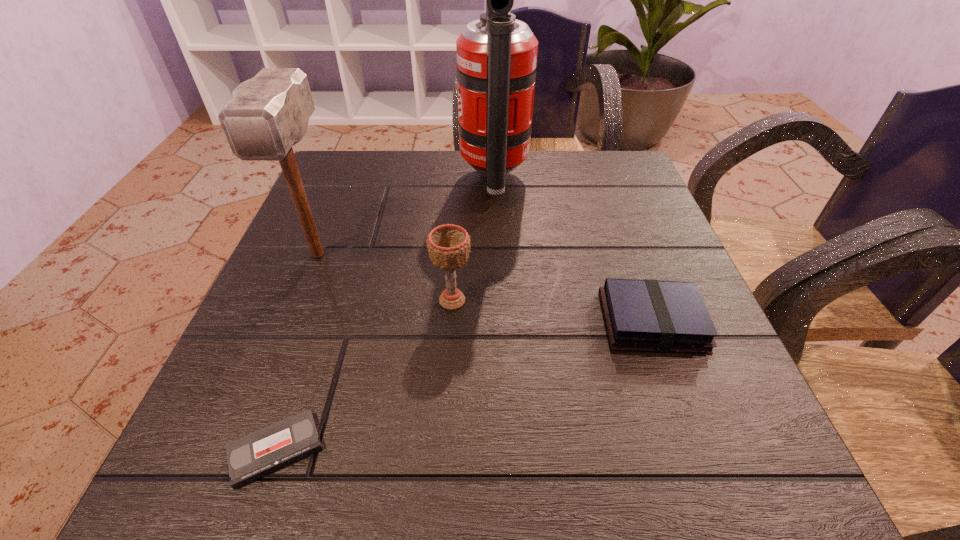
Find the location of a particular element. This screenshot has height=540, width=960. free point between the nearest object and the tallest object is located at coordinates (385, 315).

This screenshot has width=960, height=540. In order to click on empty space between the nearest object and the third tallest object in this screenshot , I will do coord(364,375).

Identify the location of free point between the book and the chalice. This screenshot has width=960, height=540. (552, 311).

Locate an element on the screen. empty space between the fire extinguisher and the videotape is located at coordinates (385, 315).

I want to click on vacant area that lies between the rightmost object and the tallest object, so click(573, 251).

In order to click on free spot between the farthest object and the second farthest object in this screenshot , I will do `click(406, 217)`.

This screenshot has width=960, height=540. I want to click on vacant area that lies between the chalice and the fire extinguisher, so click(473, 240).

Image resolution: width=960 pixels, height=540 pixels. I want to click on vacant area between the videotape and the tallest object, so click(385, 315).

Locate an element on the screen. free space between the mallet and the book is located at coordinates (485, 288).

This screenshot has height=540, width=960. I want to click on object that is the nearest to the mallet, so click(x=448, y=245).